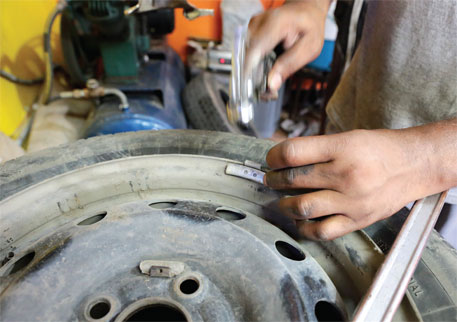
At what (x,y) coordinates should I click in order to perform the action: click on orange wall. Please return your answer as a coordinate pair (x, y). The image size is (457, 322). Looking at the image, I should click on (194, 31).